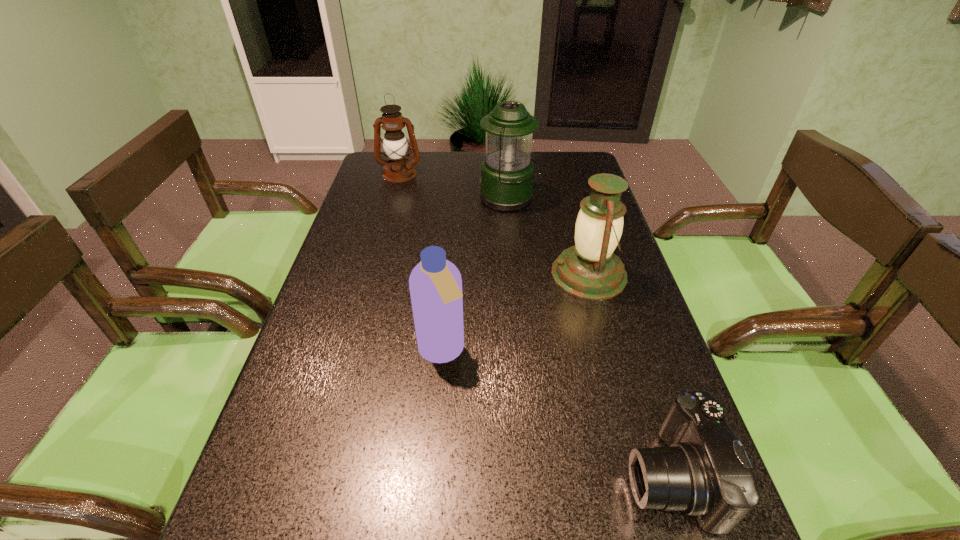
Identify which object is the fourth nearest to the third farthest object. Please provide its 2D coordinates. Your answer should be formatted as a tuple, i.e. [(x, y)], where the tuple contains the x and y coordinates of a point satisfying the conditions above.

[(398, 169)]

Identify the location of object that stands as the fourth closest to the nearest lantern. The height and width of the screenshot is (540, 960). (398, 169).

Identify which lantern is the second nearest to the farthest object. Please provide its 2D coordinates. Your answer should be formatted as a tuple, i.e. [(x, y)], where the tuple contains the x and y coordinates of a point satisfying the conditions above.

[(590, 270)]

Locate an element on the screen. The width and height of the screenshot is (960, 540). lantern that is the third closest one to the nearest object is located at coordinates (x=398, y=169).

Identify the location of blank area in the image that satisfies the following two spatial constraints: 1. on the back side of the second farthest lantern; 2. on the right side of the second object from left to right. (454, 199).

At what (x,y) coordinates should I click in order to perform the action: click on vacant region that satisfies the following two spatial constraints: 1. on the side of the fourth nearest object, there is a wick adjustment knob; 2. on the right side of the leftmost lantern. Please return your answer as a coordinate pair (x, y). This screenshot has width=960, height=540. Looking at the image, I should click on (393, 199).

Locate an element on the screen. The height and width of the screenshot is (540, 960). vacant area in the image that satisfies the following two spatial constraints: 1. on the side of the farthest lantern, there is a wick adjustment knob; 2. on the right side of the shampoo is located at coordinates (351, 352).